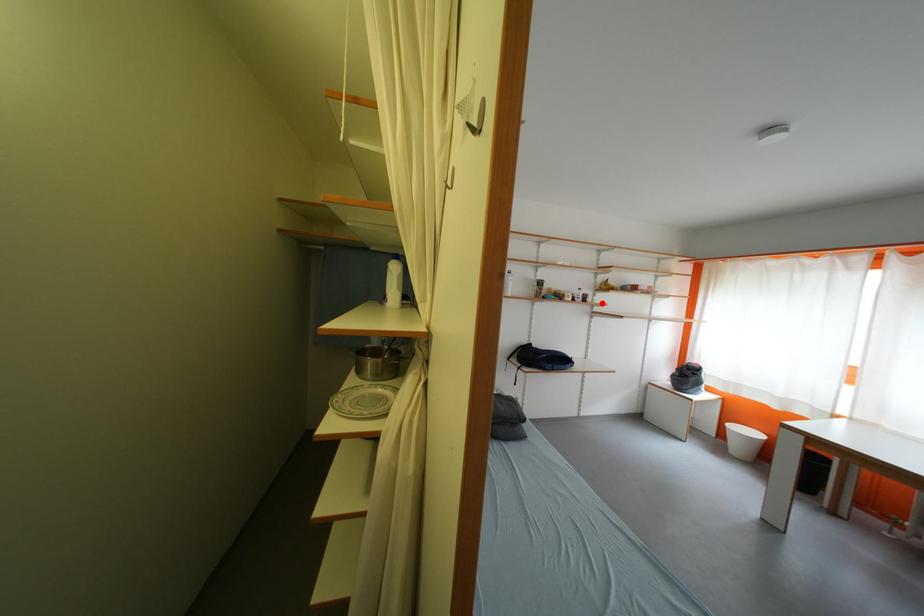
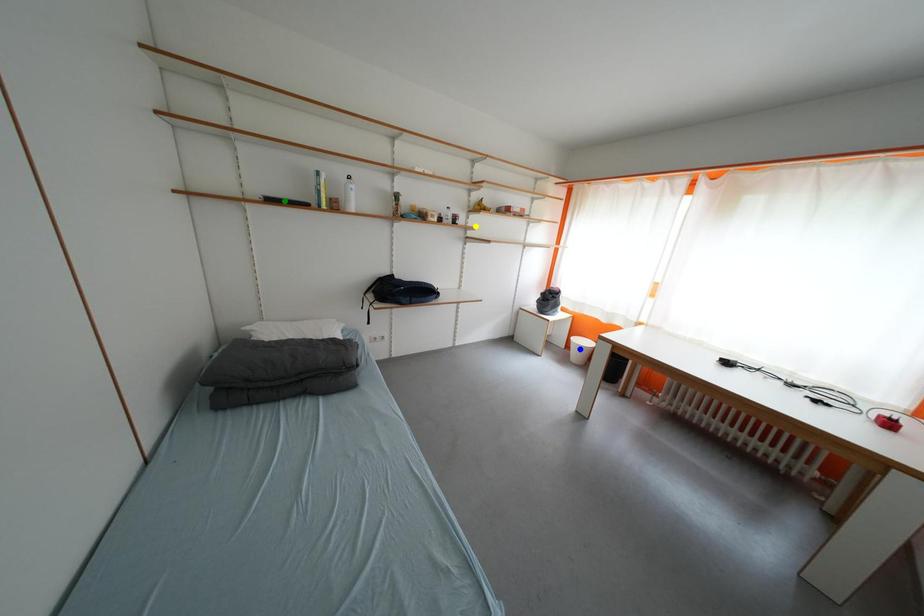
Question: I am providing you with two images of the same scene from different viewpoints. A red point is marked on the first image. You are given multiple points on the second image. Which point in image 2 represents the same 3d spot as the red point in image 1?

Choices:
 (A) blue point
 (B) yellow point
 (C) green point

Answer: (B)